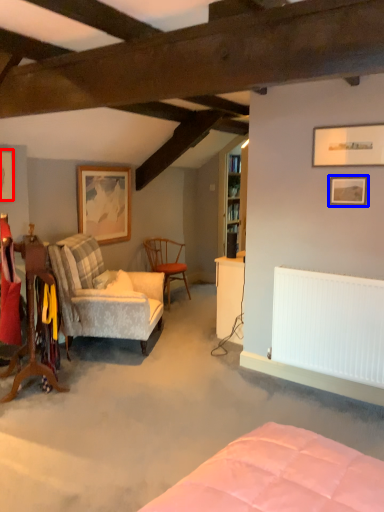
Question: Which object appears closest to the camera in this image, picture frame (highlighted by a red box) or picture frame (highlighted by a blue box)?

Choices:
 (A) picture frame
 (B) picture frame

Answer: (B)